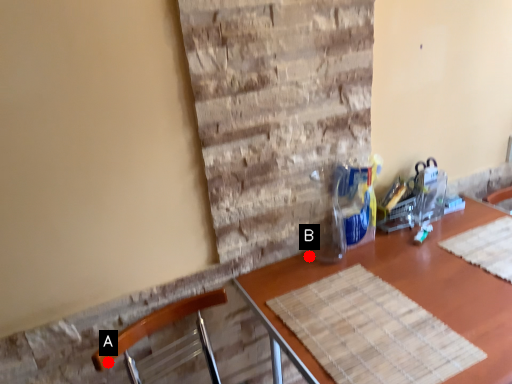
Question: Two points are circled on the image, labeled by A and B beside each circle. Which point is closer to the camera?

Choices:
 (A) A is closer
 (B) B is closer

Answer: (A)